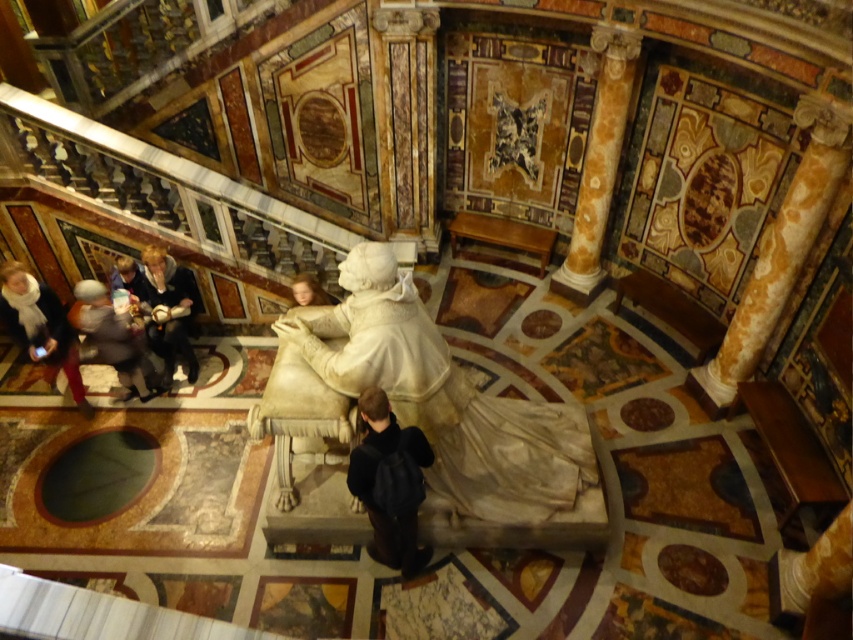
Does marble column at upper right have a lesser width compared to white scarf at lower left?

Incorrect, marble column at upper right's width is not less than white scarf at lower left's.

Between marble column at upper right and white scarf at lower left, which one appears on the left side from the viewer's perspective?

From the viewer's perspective, white scarf at lower left appears more on the left side.

Between point (566, 280) and point (28, 310), which one is positioned in front?

Point (28, 310) is more forward.

Where is `marble column at upper right`? The width and height of the screenshot is (853, 640). marble column at upper right is located at coordinates click(599, 161).

Is marble column at upper right smaller than light brown leather jacket at center?

No.

Does point (599, 51) come in front of point (169, 305)?

That is True.

Locate an element on the screen. This screenshot has width=853, height=640. marble column at upper right is located at coordinates (599, 161).

Find the location of a particular element. Image resolution: width=853 pixels, height=640 pixels. marble column at upper right is located at coordinates (599, 161).

Between marble column at upper right and black leather backpack at center, which one has less height?

black leather backpack at center is shorter.

What are the coordinates of `marble column at upper right` in the screenshot? It's located at (599, 161).

Locate an element on the screen. marble column at upper right is located at coordinates (599, 161).